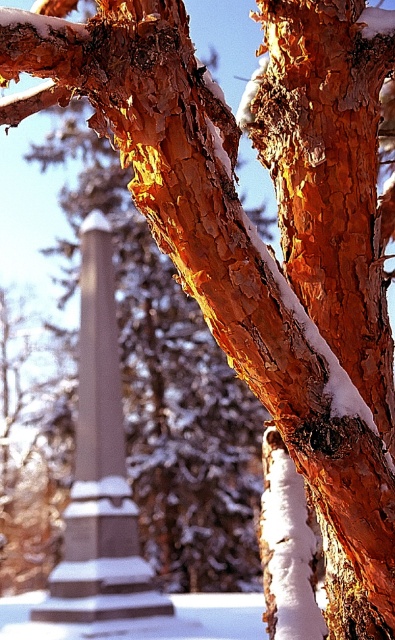
You are an architect designing a garden path that must pass between the orange bark tree trunk at center and the smooth gray stone column at center. The path must be wide enough for a wheelchair to pass comfortably. Based on the scene, can you confirm if there is sufficient space between them for a wheelchair? Please explain your reasoning.

The orange bark tree trunk at center is smaller in size compared to the smooth gray stone column at center. However, the exact distance between them isn not specified in the provided information. Without knowing the actual spacing, it is impossible to determine if the path is wide enough for a wheelchair.

You are standing in a snowy forest and see the orange bark tree trunk at center. Can you determine its exact position in terms of coordinates?

The orange bark tree trunk at center is located at point [331,177].

You are standing in front of the tree trunk and want to touch both points on the bark. Which point, point [297,76] or point [101,353], will you reach first?

Point [297,76] is closer to the camera than point [101,353], so you will reach point [297,76] first.